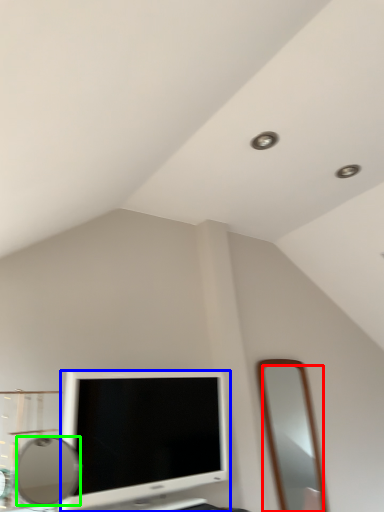
Question: Which object is the farthest from mirror (highlighted by a red box)? Choose among these: television (highlighted by a blue box) or mirror (highlighted by a green box).

Choices:
 (A) television
 (B) mirror

Answer: (A)